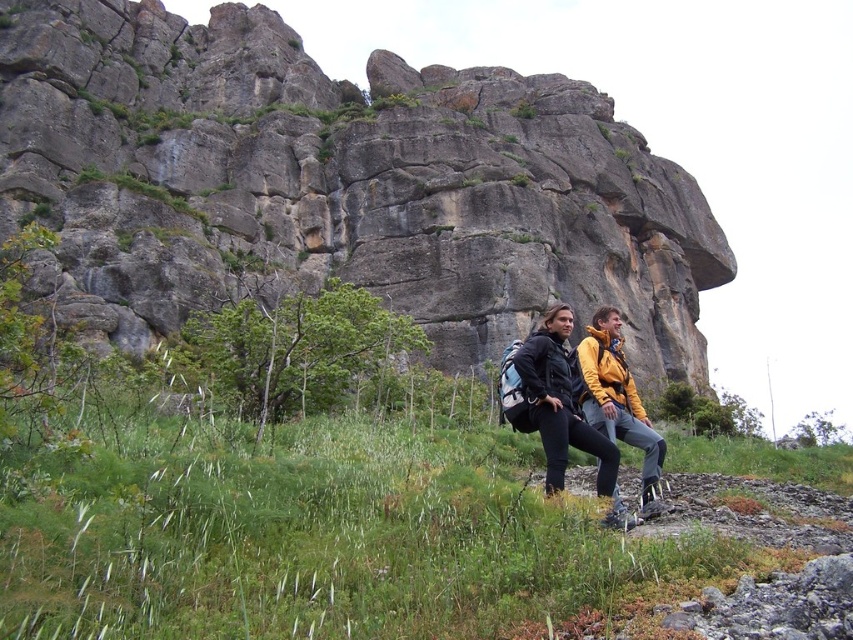
Question: Which point is closer to the camera?

Choices:
 (A) gray rock formation at upper center
 (B) green grassy at lower center

Answer: (B)

Question: Which object appears closest to the camera in this image?

Choices:
 (A) gray rock formation at upper center
 (B) green grassy at lower center
 (C) matte black jacket at center

Answer: (B)

Question: Which point is farther to the camera?

Choices:
 (A) (561, 362)
 (B) (608, 573)
 (C) (260, 218)

Answer: (C)

Question: Can you confirm if green grassy at lower center is thinner than matte black jacket at center?

Choices:
 (A) yes
 (B) no

Answer: (B)

Question: Is green grassy at lower center behind matte black jacket at center?

Choices:
 (A) no
 (B) yes

Answer: (A)

Question: Observing the image, what is the correct spatial positioning of gray rock formation at upper center in reference to green grassy at lower center?

Choices:
 (A) above
 (B) below

Answer: (A)